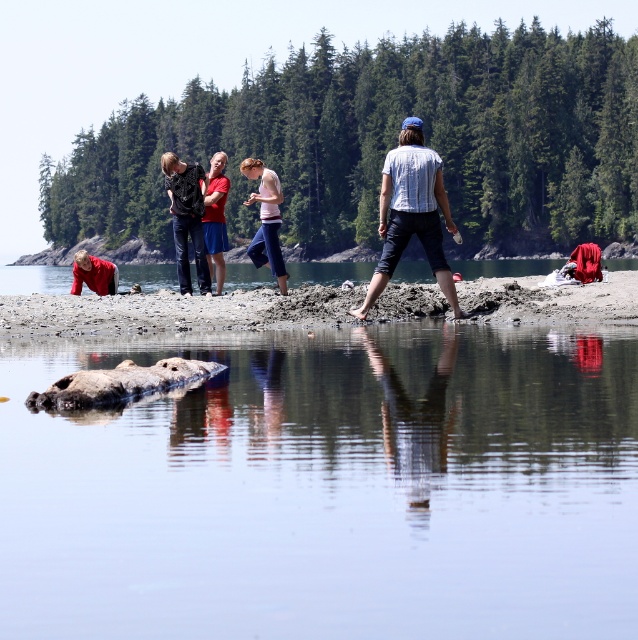
Question: Which is nearer to the smooth gray rock at center?

Choices:
 (A) matte black clothing at center
 (B) brown sandy beach at center
 (C) striped shirt at center

Answer: (B)

Question: Which point is closer to the camera taking this photo?

Choices:
 (A) (263, 241)
 (B) (417, 193)

Answer: (B)

Question: Does smooth gray rock at center lie behind matte black clothing at center?

Choices:
 (A) no
 (B) yes

Answer: (A)

Question: Estimate the real-world distances between objects in this image. Which object is farther from the matte black clothing at center?

Choices:
 (A) striped shirt at center
 (B) brown sandy beach at center
 (C) smooth gray rock at center

Answer: (C)

Question: Can you confirm if brown sandy beach at center is wider than matte black clothing at center?

Choices:
 (A) no
 (B) yes

Answer: (B)

Question: Is smooth gray rock at center smaller than striped shirt at center?

Choices:
 (A) yes
 (B) no

Answer: (B)